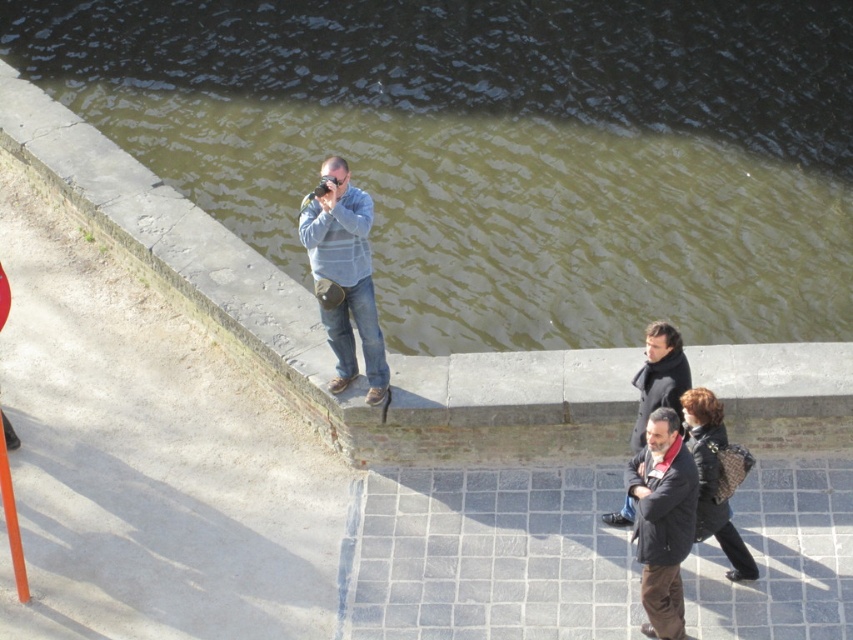
From the picture: Which of these two, greenish water at upper center or dark gray wool coat at lower right, stands shorter?

With less height is dark gray wool coat at lower right.

Can you confirm if greenish water at upper center is bigger than dark gray wool coat at lower right?

Yes.

Between point (683, 184) and point (640, 426), which one is positioned in front?

Point (640, 426) is more forward.

Where is `greenish water at upper center`? This screenshot has width=853, height=640. greenish water at upper center is located at coordinates (500, 148).

Does dark brown leather jacket at lower right appear on the left side of dark gray wool coat at lower right?

Indeed, dark brown leather jacket at lower right is positioned on the left side of dark gray wool coat at lower right.

Where is `dark brown leather jacket at lower right`? The image size is (853, 640). dark brown leather jacket at lower right is located at coordinates (663, 522).

Who is positioned more to the left, light blue sweater at center or dark gray wool coat at lower right?

light blue sweater at center is more to the left.

Between point (309, 220) and point (672, 384), which one is positioned behind?

The point (309, 220) is more distant.

Locate an element on the screen. The width and height of the screenshot is (853, 640). light blue sweater at center is located at coordinates pyautogui.click(x=344, y=275).